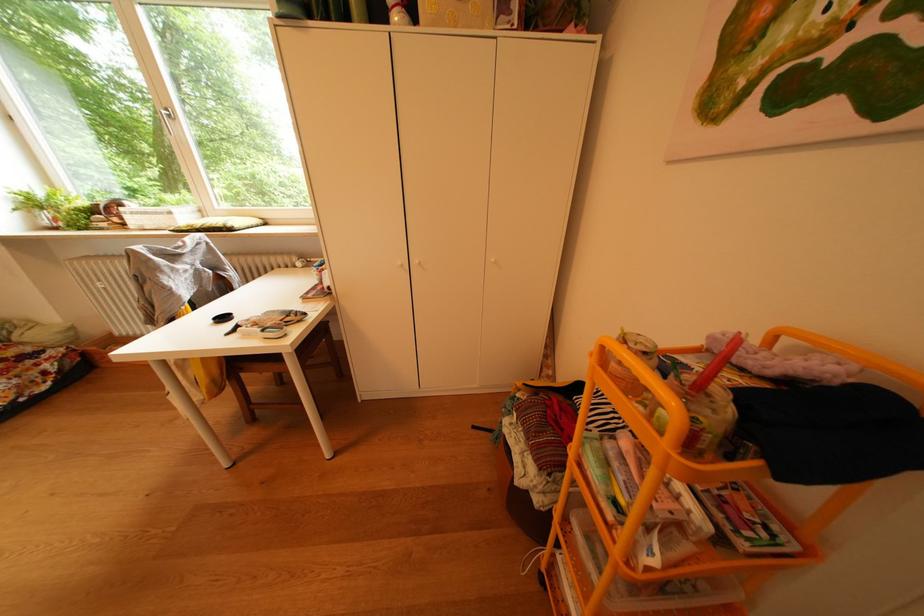
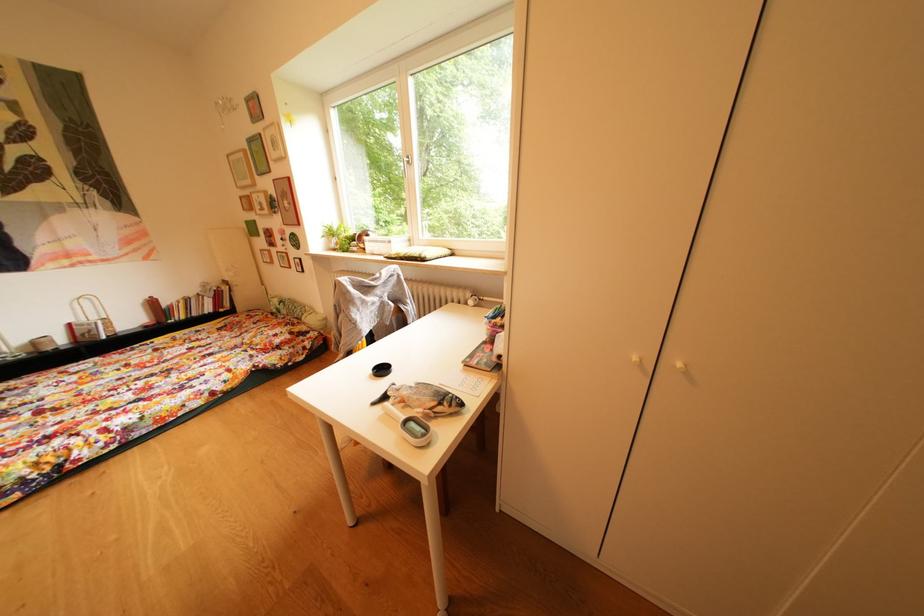
Question: The first image is from the beginning of the video and the second image is from the end. How did the camera likely rotate when shooting the video?

Choices:
 (A) Left
 (B) Right
 (C) Up
 (D) Down

Answer: (A)